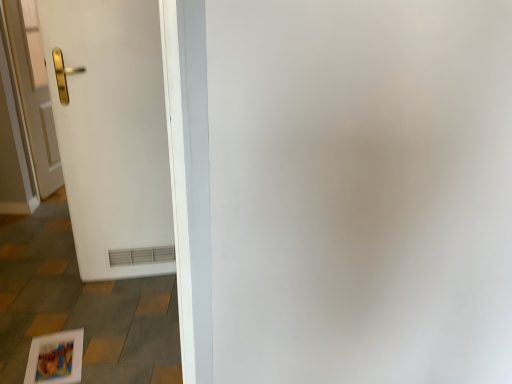
Where is `white matte door at left, which is the second door from back to front`? white matte door at left, which is the second door from back to front is located at coordinates (111, 133).

What do you see at coordinates (111, 133) in the screenshot? The height and width of the screenshot is (384, 512). I see `white matte door at left, which appears as the 1th door when viewed from the right` at bounding box center [111, 133].

Image resolution: width=512 pixels, height=384 pixels. What do you see at coordinates (33, 91) in the screenshot? I see `gold metallic handle at left, the 1th door from the left` at bounding box center [33, 91].

Where is `gold metallic handle at left, the second door in the right-to-left sequence`? gold metallic handle at left, the second door in the right-to-left sequence is located at coordinates (33, 91).

Image resolution: width=512 pixels, height=384 pixels. I want to click on white matte door at left, which appears as the 1th door when viewed from the right, so click(x=111, y=133).

Which is more to the right, white matte door at left, which appears as the second door when viewed from the left, or gold metallic handle at left, the second door in the right-to-left sequence?

white matte door at left, which appears as the second door when viewed from the left.

Between white matte door at left, which appears as the second door when viewed from the left, and gold metallic handle at left, which is the 2th door in front-to-back order, which one is positioned behind?

gold metallic handle at left, which is the 2th door in front-to-back order, is behind.

Is point (113, 3) more distant than point (45, 82)?

That is False.

From the image's perspective, is white matte door at left, which is the second door from back to front, above or below gold metallic handle at left, positioned as the 1th door in back-to-front order?

Clearly, from the image's perspective, white matte door at left, which is the second door from back to front, is below gold metallic handle at left, positioned as the 1th door in back-to-front order.

Looking at this image, from a real-world perspective, is white matte door at left, which appears as the 1th door when viewed from the right, under gold metallic handle at left, the second door in the right-to-left sequence?

Actually, white matte door at left, which appears as the 1th door when viewed from the right, is physically above gold metallic handle at left, the second door in the right-to-left sequence, in the real world.

Between white matte door at left, marked as the 1th door in a front-to-back arrangement, and gold metallic handle at left, which is the 2th door in front-to-back order, which one has larger width?

With larger width is white matte door at left, marked as the 1th door in a front-to-back arrangement.

Who is taller, white matte door at left, marked as the 1th door in a front-to-back arrangement, or gold metallic handle at left, which is the 2th door in front-to-back order?

With more height is white matte door at left, marked as the 1th door in a front-to-back arrangement.

Considering the relative sizes of white matte door at left, which appears as the 1th door when viewed from the right, and gold metallic handle at left, positioned as the 1th door in back-to-front order, in the image provided, is white matte door at left, which appears as the 1th door when viewed from the right, smaller than gold metallic handle at left, positioned as the 1th door in back-to-front order,?

Incorrect, white matte door at left, which appears as the 1th door when viewed from the right, is not smaller in size than gold metallic handle at left, positioned as the 1th door in back-to-front order.

Would you say white matte door at left, which is the second door from back to front, is outside gold metallic handle at left, which is the 2th door in front-to-back order?

Yes, white matte door at left, which is the second door from back to front, is not within gold metallic handle at left, which is the 2th door in front-to-back order.

Are white matte door at left, marked as the 1th door in a front-to-back arrangement, and gold metallic handle at left, positioned as the 1th door in back-to-front order, located far from each other?

No, there isn't a large distance between white matte door at left, marked as the 1th door in a front-to-back arrangement, and gold metallic handle at left, positioned as the 1th door in back-to-front order.

Is white matte door at left, which appears as the second door when viewed from the left, looking in the opposite direction of gold metallic handle at left, the second door in the right-to-left sequence?

white matte door at left, which appears as the second door when viewed from the left, is not turned away from gold metallic handle at left, the second door in the right-to-left sequence.

From the picture: Can you tell me how much white matte door at left, which is the second door from back to front, and gold metallic handle at left, positioned as the 1th door in back-to-front order, differ in facing direction?

The facing directions of white matte door at left, which is the second door from back to front, and gold metallic handle at left, positioned as the 1th door in back-to-front order, are 70.8 degrees apart.

Could you measure the distance between white matte door at left, marked as the 1th door in a front-to-back arrangement, and gold metallic handle at left, positioned as the 1th door in back-to-front order?

white matte door at left, marked as the 1th door in a front-to-back arrangement, and gold metallic handle at left, positioned as the 1th door in back-to-front order, are 36.60 inches apart.

Find the location of a particular element. The height and width of the screenshot is (384, 512). door to the left of white matte door at left, which appears as the 1th door when viewed from the right is located at coordinates (33, 91).

Can you confirm if gold metallic handle at left, the 1th door from the left, is positioned to the left of white matte door at left, which appears as the second door when viewed from the left?

Correct, you'll find gold metallic handle at left, the 1th door from the left, to the left of white matte door at left, which appears as the second door when viewed from the left.

Is gold metallic handle at left, positioned as the 1th door in back-to-front order, positioned before white matte door at left, which appears as the 1th door when viewed from the right?

No, it is behind white matte door at left, which appears as the 1th door when viewed from the right.

Does point (50, 171) come closer to viewer compared to point (86, 66)?

No, (50, 171) is further to viewer.

From the image's perspective, is gold metallic handle at left, positioned as the 1th door in back-to-front order, located beneath white matte door at left, marked as the 1th door in a front-to-back arrangement?

No.

From a real-world perspective, who is located lower, gold metallic handle at left, the 1th door from the left, or white matte door at left, which appears as the 1th door when viewed from the right?

gold metallic handle at left, the 1th door from the left, from a real-world perspective.

Which object is wider, gold metallic handle at left, the second door in the right-to-left sequence, or white matte door at left, which appears as the second door when viewed from the left?

Wider between the two is white matte door at left, which appears as the second door when viewed from the left.

Between gold metallic handle at left, the 1th door from the left, and white matte door at left, which is the second door from back to front, which one has more height?

white matte door at left, which is the second door from back to front, is taller.

Who is smaller, gold metallic handle at left, the 1th door from the left, or white matte door at left, which appears as the second door when viewed from the left?

Smaller between the two is gold metallic handle at left, the 1th door from the left.

Would you say gold metallic handle at left, positioned as the 1th door in back-to-front order, is outside white matte door at left, which appears as the second door when viewed from the left?

That's correct, gold metallic handle at left, positioned as the 1th door in back-to-front order, is outside of white matte door at left, which appears as the second door when viewed from the left.

Based on the photo, is gold metallic handle at left, positioned as the 1th door in back-to-front order, far from white matte door at left, which appears as the 1th door when viewed from the right?

No, gold metallic handle at left, positioned as the 1th door in back-to-front order, is in close proximity to white matte door at left, which appears as the 1th door when viewed from the right.

Is gold metallic handle at left, which is the 2th door in front-to-back order, oriented away from white matte door at left, marked as the 1th door in a front-to-back arrangement?

gold metallic handle at left, which is the 2th door in front-to-back order, does not have its back to white matte door at left, marked as the 1th door in a front-to-back arrangement.

In the scene shown: How many degrees apart are the facing directions of gold metallic handle at left, positioned as the 1th door in back-to-front order, and white matte door at left, which is the second door from back to front?

There is a 70.8-degree angle between the facing directions of gold metallic handle at left, positioned as the 1th door in back-to-front order, and white matte door at left, which is the second door from back to front.

The image size is (512, 384). I want to click on door above the gold metallic handle at left, which is the 2th door in front-to-back order (from a real-world perspective), so click(x=111, y=133).

Image resolution: width=512 pixels, height=384 pixels. Find the location of `door in front of the gold metallic handle at left, which is the 2th door in front-to-back order`. door in front of the gold metallic handle at left, which is the 2th door in front-to-back order is located at coordinates (111, 133).

Where is `door that appears below the gold metallic handle at left, the 1th door from the left (from the image's perspective)`? door that appears below the gold metallic handle at left, the 1th door from the left (from the image's perspective) is located at coordinates (111, 133).